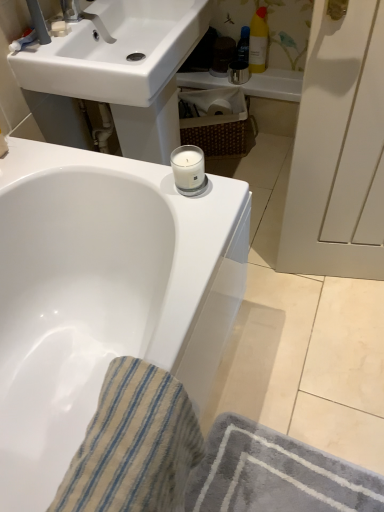
Question: Would you consider white glossy bathtub at upper center to be distant from beige striped cloth at lower left?

Choices:
 (A) no
 (B) yes

Answer: (A)

Question: Considering the relative sizes of white glossy bathtub at upper center and beige striped cloth at lower left in the image provided, is white glossy bathtub at upper center bigger than beige striped cloth at lower left?

Choices:
 (A) no
 (B) yes

Answer: (B)

Question: Is white glossy bathtub at upper center taller than beige striped cloth at lower left?

Choices:
 (A) no
 (B) yes

Answer: (B)

Question: Is white glossy bathtub at upper center positioned behind beige striped cloth at lower left?

Choices:
 (A) no
 (B) yes

Answer: (B)

Question: Is white glossy bathtub at upper center turned away from beige striped cloth at lower left?

Choices:
 (A) yes
 (B) no

Answer: (B)

Question: Is white glossy bathtub at upper center smaller than beige striped cloth at lower left?

Choices:
 (A) no
 (B) yes

Answer: (A)

Question: Is woven brown basket at center at the left side of white glossy bathtub at upper center?

Choices:
 (A) yes
 (B) no

Answer: (B)

Question: Is the depth of woven brown basket at center less than that of white glossy bathtub at upper center?

Choices:
 (A) yes
 (B) no

Answer: (B)

Question: Is woven brown basket at center at the right side of white glossy bathtub at upper center?

Choices:
 (A) yes
 (B) no

Answer: (A)

Question: From the image's perspective, is woven brown basket at center under white glossy bathtub at upper center?

Choices:
 (A) yes
 (B) no

Answer: (B)

Question: Could you tell me if woven brown basket at center is turned towards white glossy bathtub at upper center?

Choices:
 (A) no
 (B) yes

Answer: (B)

Question: Is woven brown basket at center next to white glossy bathtub at upper center?

Choices:
 (A) no
 (B) yes

Answer: (A)

Question: Is white glossy bathtub at upper center inside matte white faucet at upper left?

Choices:
 (A) no
 (B) yes

Answer: (A)